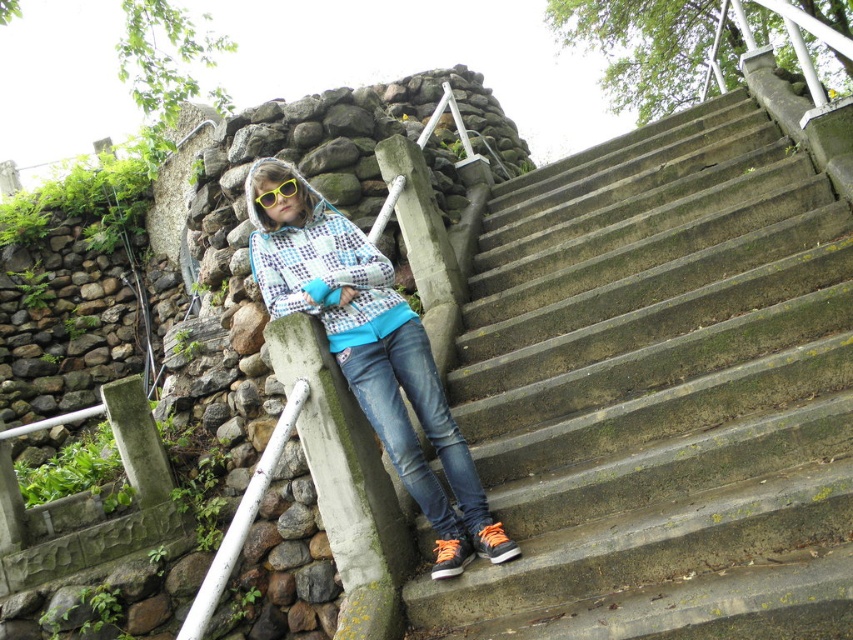
Question: Which point is closer to the camera?

Choices:
 (A) (280, 182)
 (B) (347, 266)

Answer: (A)

Question: Is denim jeans at lower center smaller than plaid fabric at center?

Choices:
 (A) yes
 (B) no

Answer: (A)

Question: Does concrete stairs at center have a smaller size compared to denim jeans at lower center?

Choices:
 (A) yes
 (B) no

Answer: (B)

Question: Which point appears farthest from the camera in this image?

Choices:
 (A) (415, 451)
 (B) (271, 205)

Answer: (B)

Question: Can you confirm if concrete stairs at center is positioned below matte blue hoodie at center?

Choices:
 (A) no
 (B) yes

Answer: (B)

Question: Which of the following is the closest to the observer?

Choices:
 (A) (277, 195)
 (B) (440, 438)
 (C) (361, 300)
 (D) (402, 435)

Answer: (D)